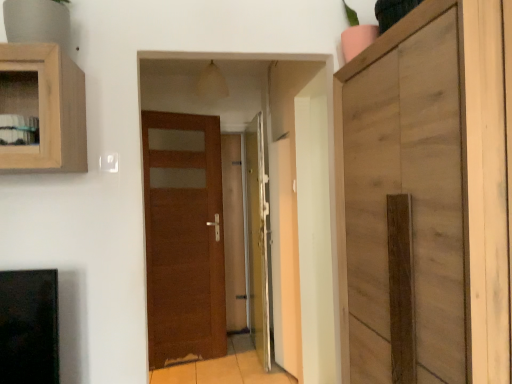
Question: Is point (228, 223) positioned closer to the camera than point (446, 188)?

Choices:
 (A) closer
 (B) farther

Answer: (B)

Question: Visually, is transparent glass door at center positioned to the left or to the right of wooden cabinet at right?

Choices:
 (A) left
 (B) right

Answer: (A)

Question: Estimate the real-world distances between objects in this image. Which object is closer to the translucent glass door at center, which is the second door in left-to-right order?

Choices:
 (A) transparent glass door at center
 (B) wooden cabinet at right
 (C) brown wood door at center, arranged as the second door when viewed from the right

Answer: (C)

Question: Estimate the real-world distances between objects in this image. Which object is farther from the wooden cabinet at right?

Choices:
 (A) transparent glass door at center
 (B) translucent glass door at center, the first door from the right
 (C) brown wood door at center, the first door when ordered from left to right

Answer: (A)